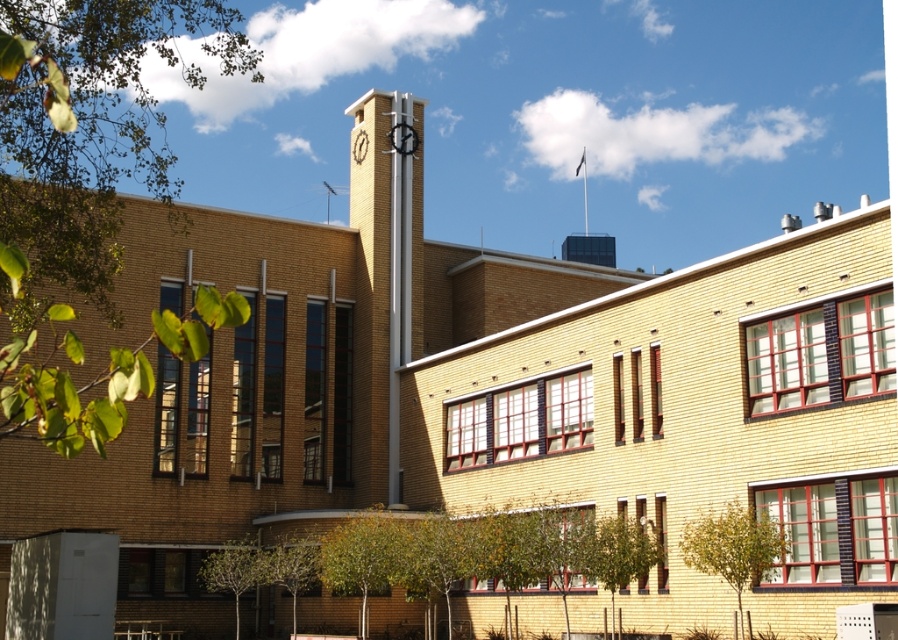
In the scene shown: Is the position of brick clock tower at center less distant than that of white metallic clock at center?

Yes.

How far apart are brick clock tower at center and white metallic clock at center?

brick clock tower at center is 16.51 feet from white metallic clock at center.

Does point (392, 125) come farther from viewer compared to point (363, 145)?

No, it is not.

Identify the location of brick clock tower at center. (394, 260).

Is point (408, 134) less distant than point (359, 147)?

Yes.

This screenshot has height=640, width=898. I want to click on black glossy clock at center, so (403, 138).

Is brick clock tower at center smaller than black glossy clock at center?

Incorrect, brick clock tower at center is not smaller in size than black glossy clock at center.

Does brick clock tower at center have a lesser height compared to black glossy clock at center?

No, brick clock tower at center is not shorter than black glossy clock at center.

Describe the element at coordinates (394, 260) in the screenshot. The width and height of the screenshot is (898, 640). I see `brick clock tower at center` at that location.

Find the location of a particular element. brick clock tower at center is located at coordinates (394, 260).